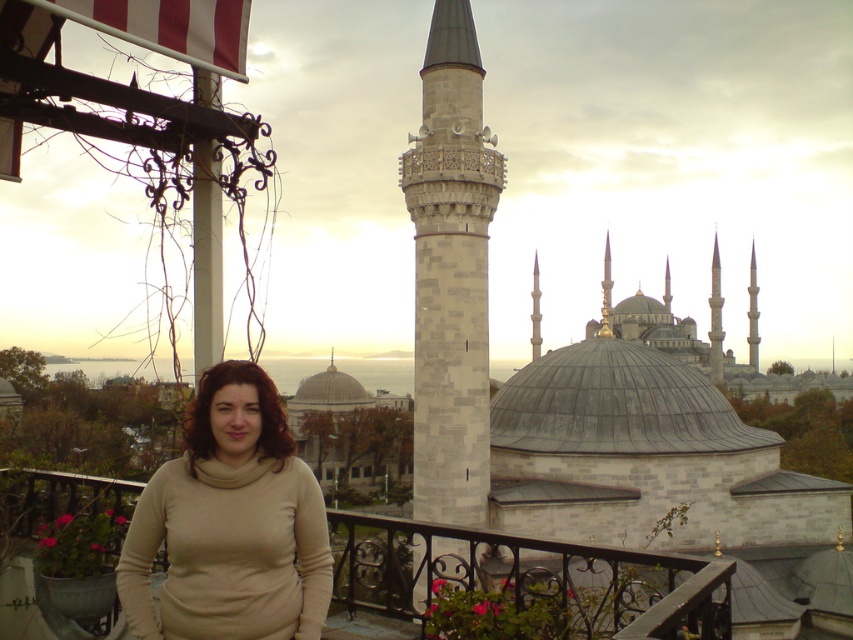
Describe the element at coordinates (230, 524) in the screenshot. Image resolution: width=853 pixels, height=640 pixels. I see `beige turtleneck sweater at center` at that location.

Can you confirm if beige turtleneck sweater at center is positioned below white marble minaret at center?

Incorrect, beige turtleneck sweater at center is not positioned below white marble minaret at center.

Does point (259, 540) come farther from viewer compared to point (447, 481)?

No, it is not.

Find the location of a particular element. This screenshot has width=853, height=640. beige turtleneck sweater at center is located at coordinates (230, 524).

Is point (419, 544) farther from viewer compared to point (196, 236)?

Yes, point (419, 544) is farther from viewer.

Which is behind, point (606, 612) or point (196, 272)?

Positioned behind is point (606, 612).

Is point (636, 620) closer to camera compared to point (219, 353)?

Yes, it is in front of point (219, 353).

At what (x,y) coordinates should I click in order to perform the action: click on black wrought iron railing at lower center. Please return your answer as a coordinate pair (x, y). Image resolution: width=853 pixels, height=640 pixels. Looking at the image, I should click on (527, 577).

Does beige turtleneck sweater at center have a larger size compared to metallic wrought iron at left?

Yes, beige turtleneck sweater at center is bigger than metallic wrought iron at left.

Can you confirm if beige turtleneck sweater at center is taller than metallic wrought iron at left?

In fact, beige turtleneck sweater at center may be shorter than metallic wrought iron at left.

What do you see at coordinates (230, 524) in the screenshot? I see `beige turtleneck sweater at center` at bounding box center [230, 524].

Where is `beige turtleneck sweater at center`? beige turtleneck sweater at center is located at coordinates (230, 524).